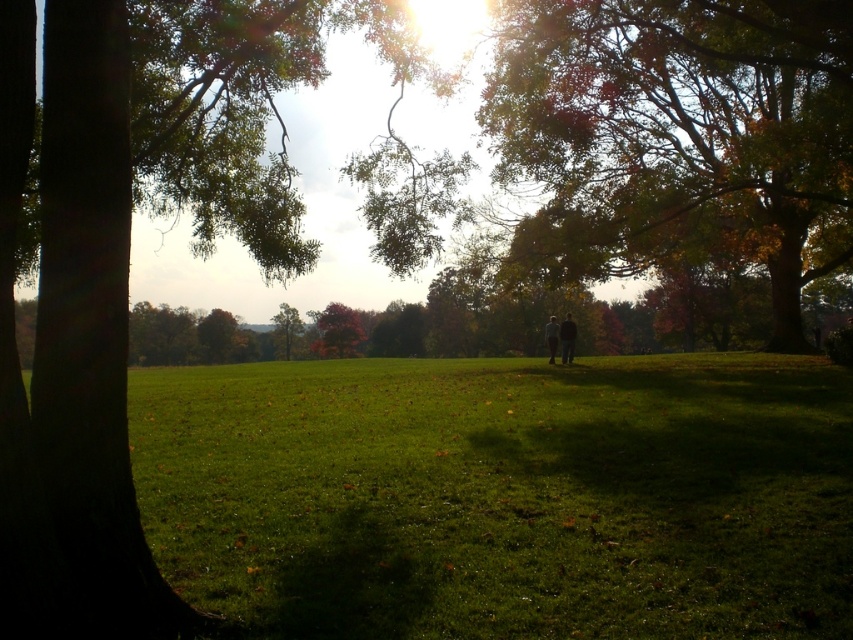
Who is lower down, green grass at center or light brown leather jacket at center?

green grass at center is below.

Is green grass at center behind light brown leather jacket at center?

No, it is not.

Which is behind, point (453, 570) or point (549, 323)?

The point (549, 323) is behind.

Where is `green grass at center`? green grass at center is located at coordinates (503, 496).

Can you confirm if green leafy tree at left is shorter than light brown leather jacket at center?

No.

Image resolution: width=853 pixels, height=640 pixels. In order to click on green leafy tree at left in this screenshot , I will do `click(128, 257)`.

Which is above, green leafy tree at center or dark brown leather jacket at center?

green leafy tree at center is higher up.

Locate an element on the screen. green leafy tree at center is located at coordinates (287, 324).

Identify the location of green leafy tree at center. Image resolution: width=853 pixels, height=640 pixels. (287, 324).

Locate an element on the screen. Image resolution: width=853 pixels, height=640 pixels. green leafy tree at center is located at coordinates (287, 324).